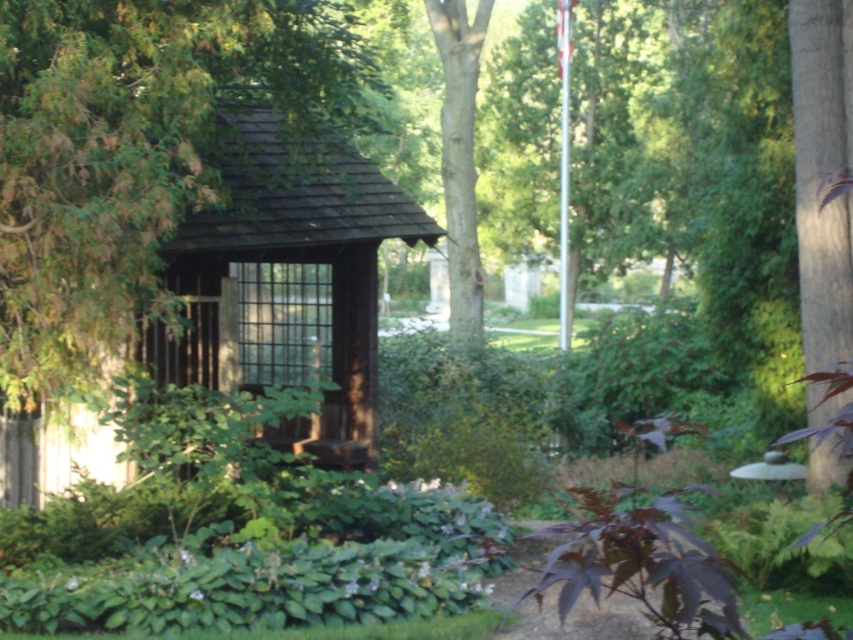
Question: Among these points, which one is farthest from the camera?

Choices:
 (A) (817, 90)
 (B) (438, 12)
 (C) (318, 296)

Answer: (B)

Question: Is brown wooden hut at center to the right of smooth brown bark at upper center from the viewer's perspective?

Choices:
 (A) no
 (B) yes

Answer: (A)

Question: Does brown wooden hut at center have a larger size compared to green textured bark at right?

Choices:
 (A) no
 (B) yes

Answer: (B)

Question: Can you confirm if brown wooden hut at center is positioned above smooth brown bark at upper center?

Choices:
 (A) yes
 (B) no

Answer: (B)

Question: Which of the following is the closest to the observer?

Choices:
 (A) (471, 99)
 (B) (850, 308)

Answer: (B)

Question: Estimate the real-world distances between objects in this image. Which object is closer to the green textured bark at right?

Choices:
 (A) brown wooden hut at center
 (B) smooth brown bark at upper center

Answer: (A)